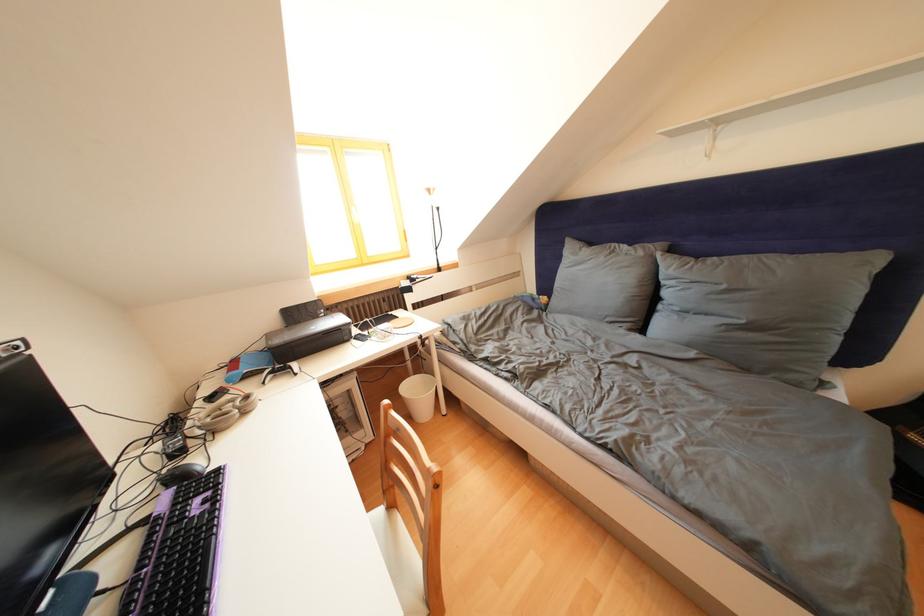
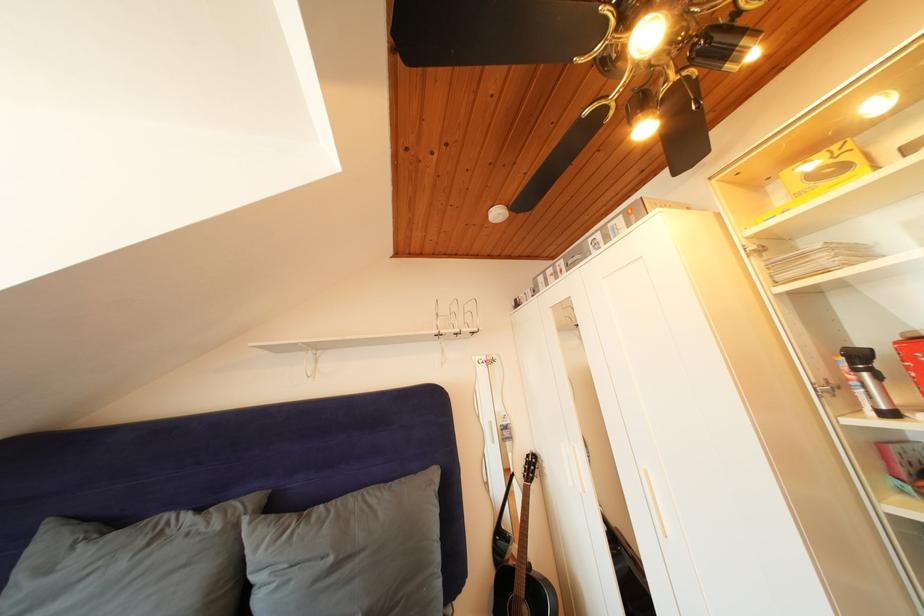
Locate, in the second image, the point that corresponds to pixel 649 259 in the first image.

(225, 531)